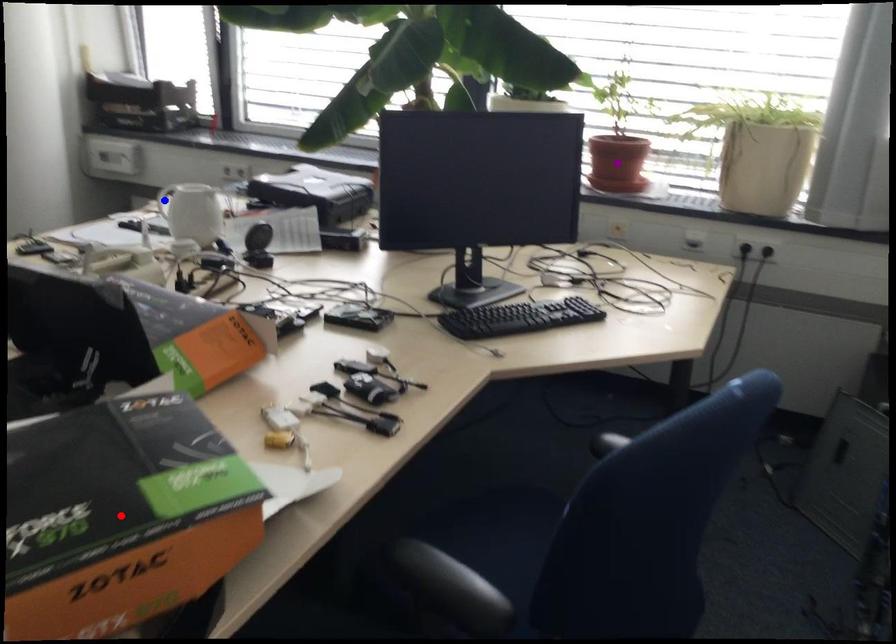
Order these from nearest to farthest:
A) red point
B) blue point
C) purple point

red point
blue point
purple point